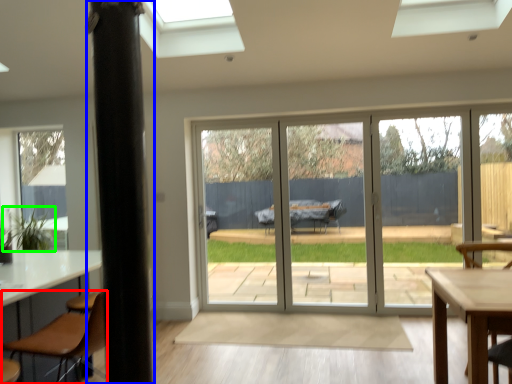
Question: Considering the real-world distances, which object is farthest from chair (highlighted by a red box)? pillar (highlighted by a blue box) or plant (highlighted by a green box)?

Choices:
 (A) pillar
 (B) plant

Answer: (B)